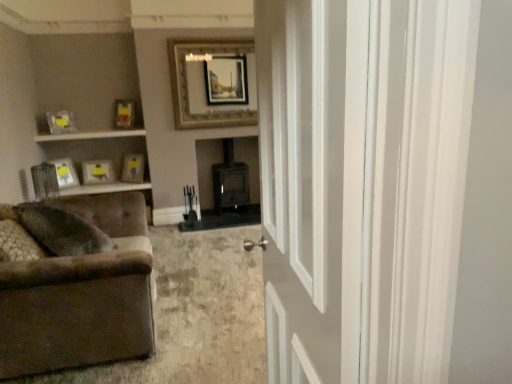
Question: Should I look upward or downward to see brown fabric couch at lower left?

Choices:
 (A) down
 (B) up

Answer: (A)

Question: Should I look upward or downward to see white glossy door at center?

Choices:
 (A) up
 (B) down

Answer: (B)

Question: Can you confirm if matte yellow picture frame at upper left, acting as the second picture frame starting from the left, is shorter than white glossy door at center?

Choices:
 (A) yes
 (B) no

Answer: (A)

Question: Is matte yellow picture frame at upper left, acting as the second picture frame starting from the left, thinner than white glossy door at center?

Choices:
 (A) no
 (B) yes

Answer: (B)

Question: Is matte yellow picture frame at upper left, acting as the second picture frame starting from the left, facing away from white glossy door at center?

Choices:
 (A) yes
 (B) no

Answer: (B)

Question: Can you confirm if matte yellow picture frame at upper left, the 5th picture frame viewed from the right, is wider than white glossy door at center?

Choices:
 (A) no
 (B) yes

Answer: (A)

Question: From a real-world perspective, is matte yellow picture frame at upper left, the 5th picture frame viewed from the right, over white glossy door at center?

Choices:
 (A) no
 (B) yes

Answer: (B)

Question: From the image's perspective, is matte yellow picture frame at upper left, acting as the second picture frame starting from the left, under white glossy door at center?

Choices:
 (A) no
 (B) yes

Answer: (A)

Question: Considering the relative sizes of white glossy door at center and matte yellow picture frame at upper left, which is counted as the third picture frame, starting from the right, in the image provided, is white glossy door at center thinner than matte yellow picture frame at upper left, which is counted as the third picture frame, starting from the right,?

Choices:
 (A) yes
 (B) no

Answer: (B)

Question: Is white glossy door at center in front of matte yellow picture frame at upper left, the 4th picture frame viewed from the left?

Choices:
 (A) yes
 (B) no

Answer: (A)

Question: Is matte yellow picture frame at upper left, the 4th picture frame viewed from the left, a part of white glossy door at center?

Choices:
 (A) yes
 (B) no

Answer: (B)

Question: From a real-world perspective, is white glossy door at center positioned over matte yellow picture frame at upper left, which is counted as the third picture frame, starting from the right, based on gravity?

Choices:
 (A) yes
 (B) no

Answer: (B)

Question: From the image's perspective, is white glossy door at center beneath matte yellow picture frame at upper left, the 4th picture frame viewed from the left?

Choices:
 (A) no
 (B) yes

Answer: (B)

Question: Can you see white glossy door at center touching matte yellow picture frame at upper left, the 4th picture frame viewed from the left?

Choices:
 (A) no
 (B) yes

Answer: (A)

Question: From the image's perspective, is matte yellow picture frame at upper left, the 4th picture frame viewed from the left, on matte silver picture frame at left, the first picture frame viewed from the left?

Choices:
 (A) yes
 (B) no

Answer: (A)